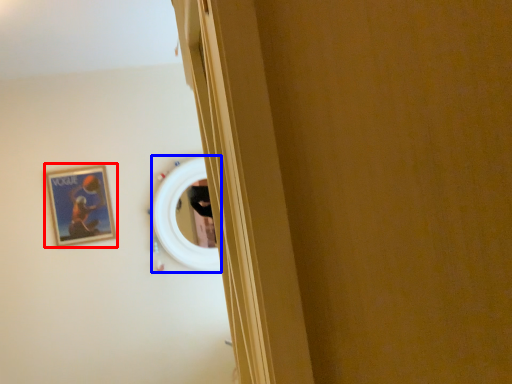
Question: Which of the following is the closest to the observer, picture frame (highlighted by a red box) or mirror (highlighted by a blue box)?

Choices:
 (A) picture frame
 (B) mirror

Answer: (A)